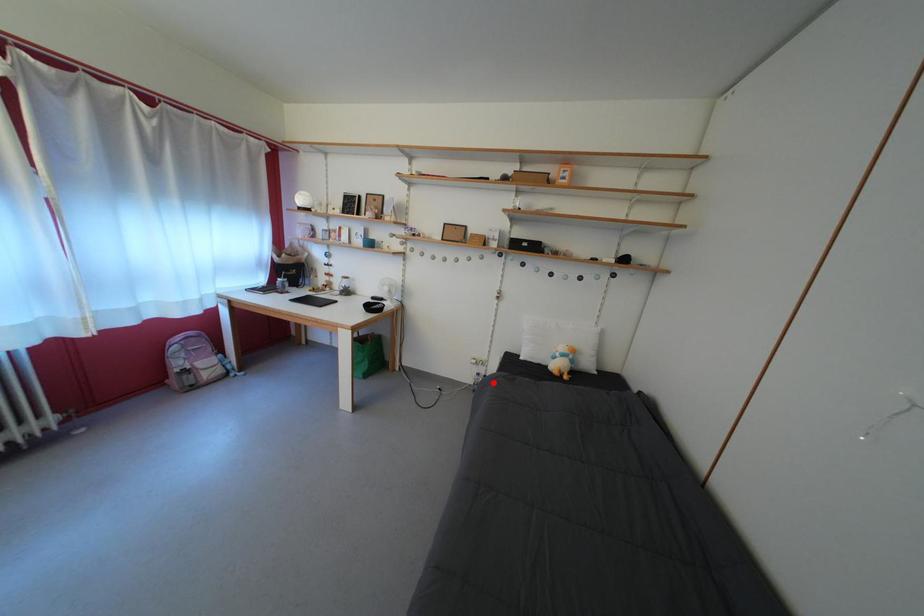
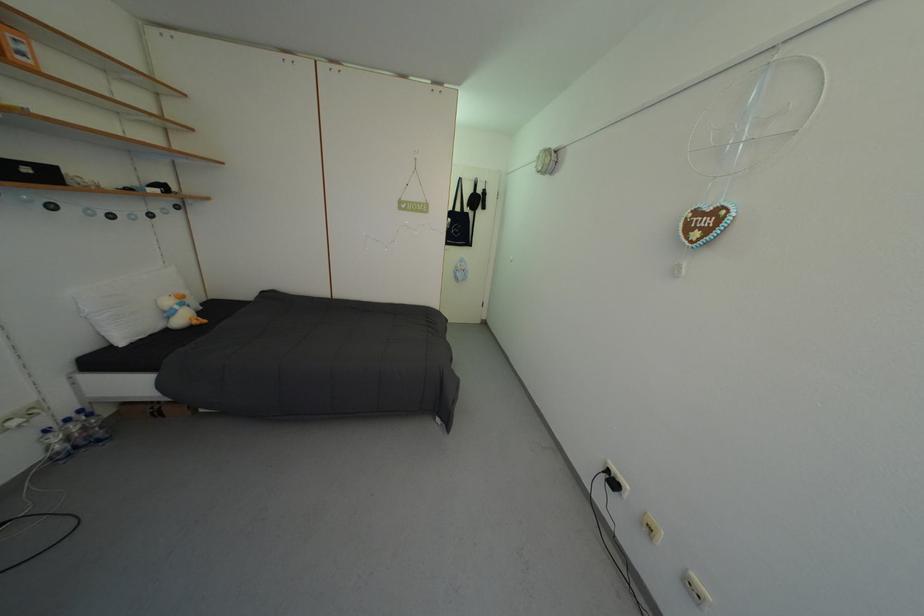
Question: I am providing you with two images of the same scene from different viewpoints. Given a red point in image1, look at the same physical point in image2. Is it:

Choices:
 (A) Closer to the viewpoint
 (B) Farther from the viewpoint

Answer: (A)